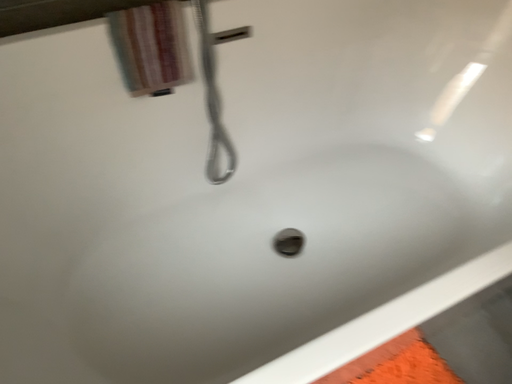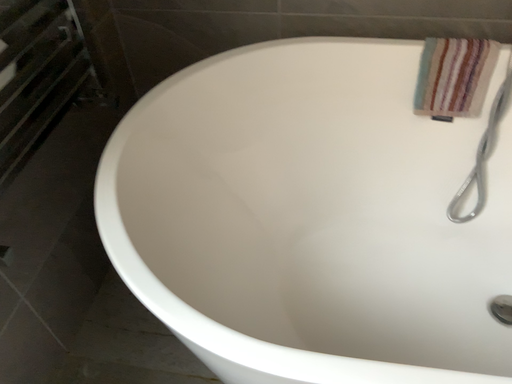
Question: Which way did the camera rotate in the video?

Choices:
 (A) rotated right
 (B) rotated left

Answer: (B)